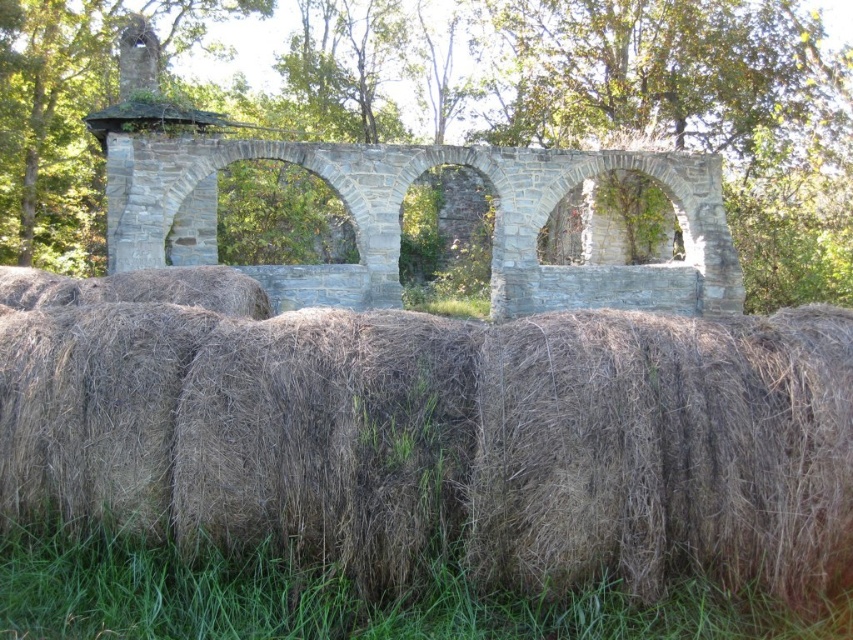
Question: Which of the following is the farthest from the observer?

Choices:
 (A) (113, 192)
 (B) (74, 420)

Answer: (A)

Question: From the image, what is the correct spatial relationship of brown straw bales at lower center in relation to gray stone arches at center?

Choices:
 (A) above
 (B) below

Answer: (B)

Question: Considering the real-world distances, which object is closest to the brown straw bales at lower center?

Choices:
 (A) gray stone arches at center
 (B) dry straw at lower center

Answer: (B)

Question: Can you confirm if brown straw bales at lower center is positioned above dry straw at lower center?

Choices:
 (A) no
 (B) yes

Answer: (B)

Question: Among these objects, which one is nearest to the camera?

Choices:
 (A) brown straw bales at lower center
 (B) dry straw at lower center
 (C) gray stone arches at center

Answer: (B)

Question: Is gray stone arches at center smaller than dry straw at lower center?

Choices:
 (A) no
 (B) yes

Answer: (A)